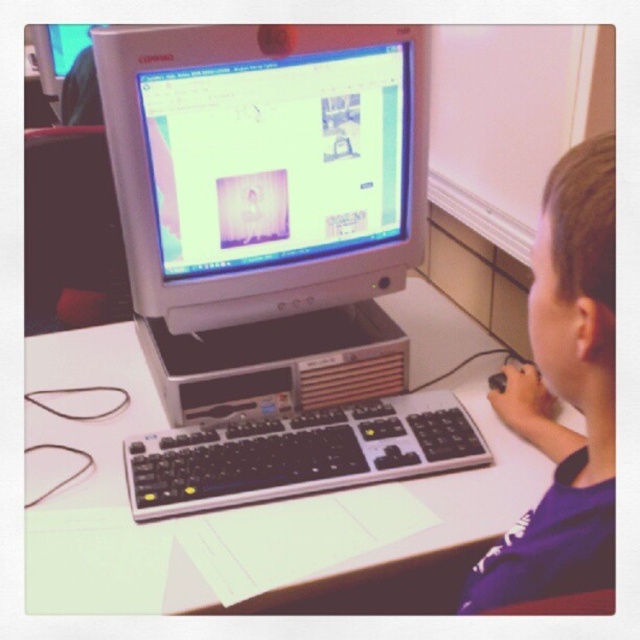
You are a person who is 160 cm tall and want to use the white plastic table at center and the matte black monitor at upper left. Considering your height, which object would be more comfortable for you to interact with and why?

The white plastic table at center is much taller than the matte black monitor at upper left. Since you are 160 cm tall, the table might be at a comfortable height for your arms and posture, while the monitor being lower could require you to tilt your head down, potentially causing discomfort over time.

You are trying to reach for the keyboard while sitting at the desk. Which object, the matte silver monitor at center or the black plastic keyboard at center, is closer to you?

The black plastic keyboard at center is closer to you because it is positioned in front of the matte silver monitor at center, which is behind it.

Consider the image. You are standing at the desk and see two points marked on the desk surface. The first point is at coordinate point (492, 480) and the second point is at coordinate point (586, 328). Which point is closer to you?

Point (586, 328) is closer to you because it is in front of point (492, 480).